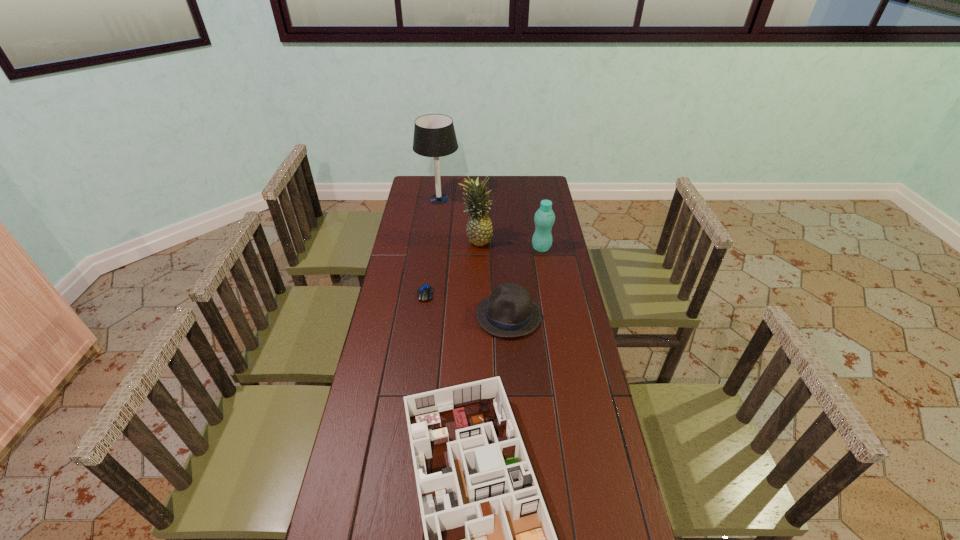
In the image, there is a desktop. Where is `vacant region at the left edge`? Image resolution: width=960 pixels, height=540 pixels. vacant region at the left edge is located at coordinates (372, 404).

I want to click on vacant space at the right edge of the desktop, so click(x=576, y=354).

The height and width of the screenshot is (540, 960). Find the location of `vacant space at the far left corner`. vacant space at the far left corner is located at coordinates (429, 194).

In order to click on empty space that is in between the fifth shortest object and the shortest object in this screenshot , I will do `click(451, 267)`.

This screenshot has height=540, width=960. I want to click on vacant area that lies between the computer mouse and the third tallest object, so click(483, 271).

At what (x,y) coordinates should I click in order to perform the action: click on free space between the tallest object and the bowler hat. Please return your answer as a coordinate pair (x, y). The height and width of the screenshot is (540, 960). Looking at the image, I should click on coord(473,257).

The height and width of the screenshot is (540, 960). I want to click on vacant area between the pineapple and the shortest object, so click(451, 267).

This screenshot has width=960, height=540. Identify the location of free space between the computer mouse and the bottle. (483, 271).

At what (x,y) coordinates should I click in order to perform the action: click on vacant space in between the second tallest object and the shortest object. Please return your answer as a coordinate pair (x, y). This screenshot has width=960, height=540. Looking at the image, I should click on (451, 267).

The width and height of the screenshot is (960, 540). I want to click on vacant point located between the second tallest object and the table lamp, so click(x=458, y=219).